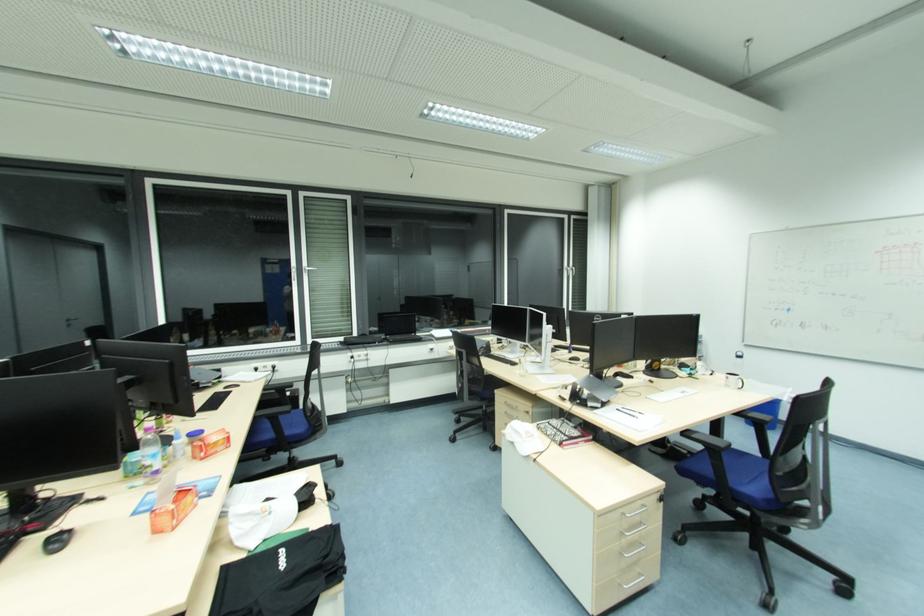
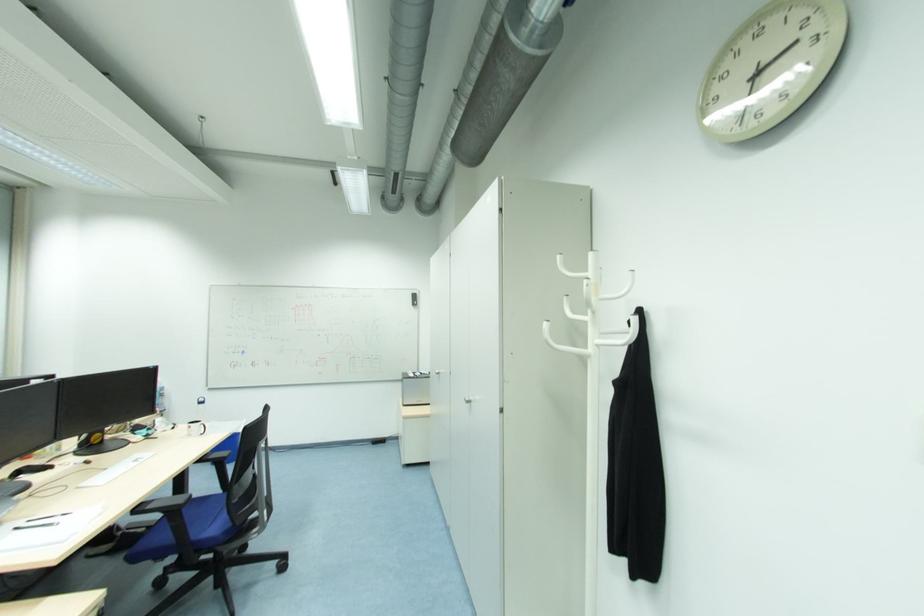
Question: The camera is either moving clockwise (left) or counter-clockwise (right) around the object. The first image is from the beginning of the video and the second image is from the end. Is the camera moving left or right when shooting the video?

Choices:
 (A) Left
 (B) Right

Answer: (A)